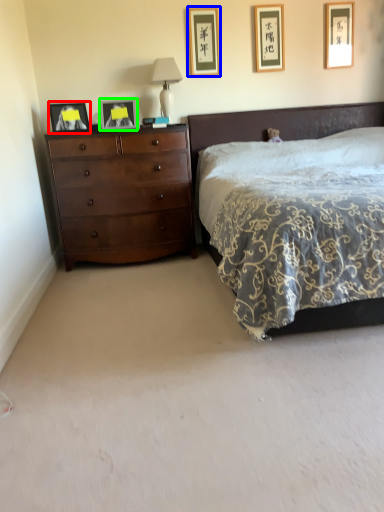
Question: Estimate the real-world distances between objects in this image. Which object is closer to picture frame (highlighted by a red box), picture frame (highlighted by a blue box) or picture frame (highlighted by a green box)?

Choices:
 (A) picture frame
 (B) picture frame

Answer: (B)